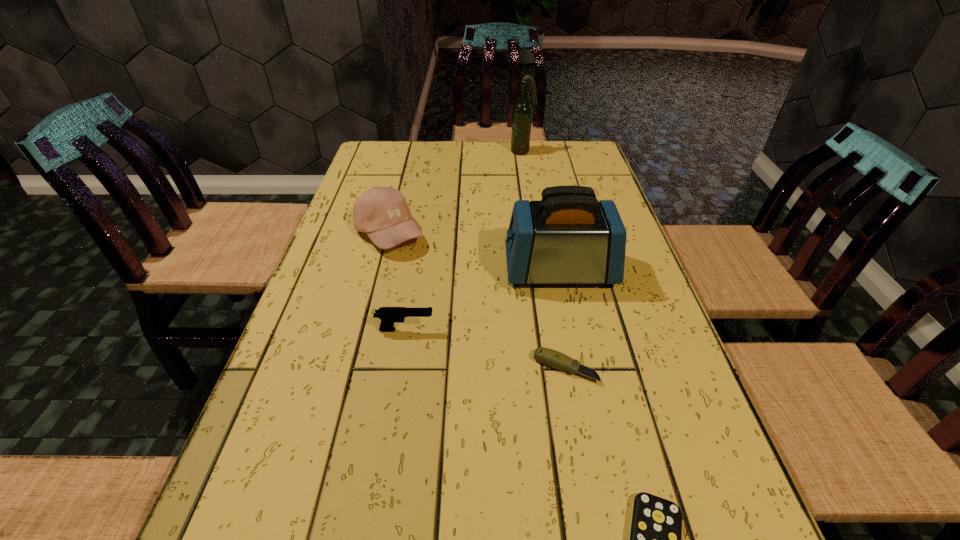
The width and height of the screenshot is (960, 540). Identify the location of the farthest object. (522, 111).

Where is `toaster`? toaster is located at coordinates (568, 237).

This screenshot has width=960, height=540. Identify the location of baseball cap. (382, 213).

This screenshot has width=960, height=540. In order to click on pistol in this screenshot , I will do `click(388, 315)`.

Where is `the third nearest object`? the third nearest object is located at coordinates (388, 315).

Where is `pocketknife`? This screenshot has height=540, width=960. pocketknife is located at coordinates (551, 358).

You are a GUI agent. You are given a task and a screenshot of the screen. Output one action in this format:
    pyautogui.click(x=<x>, y=<y>)
    Task: Click on the free location located 0.120m on the right of the farthest object
    This screenshot has height=540, width=960.
    Given the screenshot: What is the action you would take?
    pyautogui.click(x=569, y=151)

You are a GUI agent. You are given a task and a screenshot of the screen. Output one action in this format:
    pyautogui.click(x=<x>, y=<y>)
    Task: Click on the vacant space located on the front-facing side of the toaster
    This screenshot has width=960, height=540.
    Given the screenshot: What is the action you would take?
    pyautogui.click(x=381, y=271)

Locate an element on the screen. The width and height of the screenshot is (960, 540). vacant area situated on the front-facing side of the toaster is located at coordinates (397, 271).

Locate an element on the screen. The width and height of the screenshot is (960, 540). free spot located on the front-facing side of the toaster is located at coordinates (435, 271).